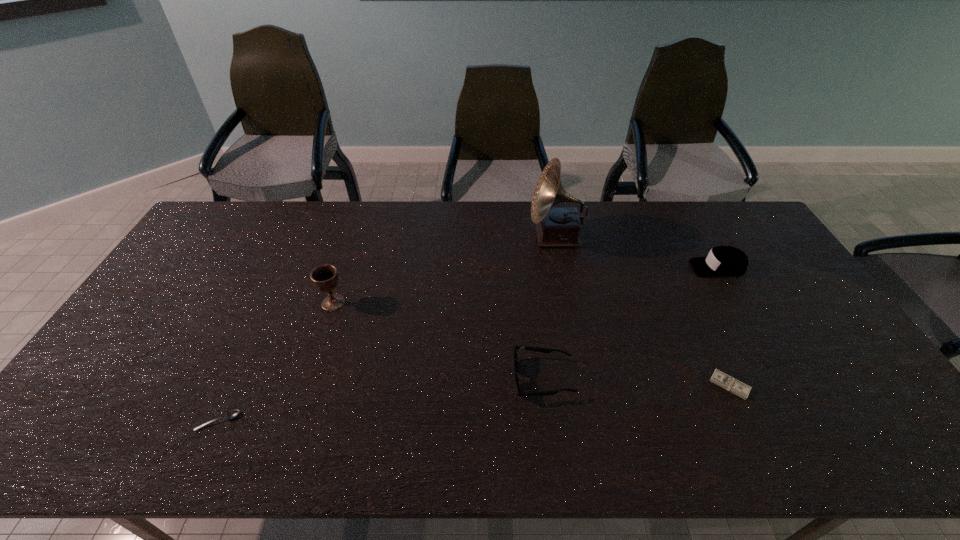
Where is `vacant space located 0.210m on the horn of the tallest object`? The width and height of the screenshot is (960, 540). vacant space located 0.210m on the horn of the tallest object is located at coordinates (469, 237).

This screenshot has height=540, width=960. What are the coordinates of `vacant space located on the horn of the tallest object` in the screenshot? It's located at (461, 237).

You are a GUI agent. You are given a task and a screenshot of the screen. Output one action in this format:
    pyautogui.click(x=<x>, y=<y>)
    Task: Click on the vacant region located on the right of the second tallest object
    Image resolution: width=960 pixels, height=540 pixels.
    Given the screenshot: What is the action you would take?
    pyautogui.click(x=413, y=302)

You are a GUI agent. You are given a task and a screenshot of the screen. Output one action in this format:
    pyautogui.click(x=<x>, y=<y>)
    Task: Click on the vacant space located on the front-facing side of the cap
    The height and width of the screenshot is (540, 960).
    Given the screenshot: What is the action you would take?
    pyautogui.click(x=614, y=267)

Find the location of `vacant space located on the front-facing side of the cap`. vacant space located on the front-facing side of the cap is located at coordinates (620, 267).

Where is `vacant region located 0.330m on the front-facing side of the cap`? Image resolution: width=960 pixels, height=540 pixels. vacant region located 0.330m on the front-facing side of the cap is located at coordinates (589, 267).

Where is `free space located 0.280m on the front-facing side of the third shortest object`? free space located 0.280m on the front-facing side of the third shortest object is located at coordinates (403, 378).

You are a GUI agent. You are given a task and a screenshot of the screen. Output one action in this format:
    pyautogui.click(x=<x>, y=<y>)
    Task: Click on the vacant space situated on the front-facing side of the third shortest object
    
    Given the screenshot: What is the action you would take?
    pyautogui.click(x=419, y=378)

I want to click on free space located on the front-facing side of the third shortest object, so click(x=356, y=378).

Identify the location of blank space located on the back of the money. (708, 341).